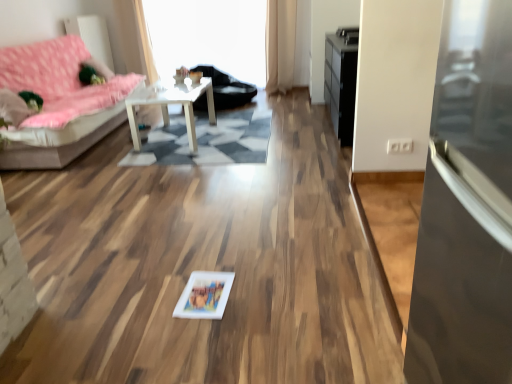
The height and width of the screenshot is (384, 512). In order to click on free location in front of white glossy picture frame at center in this screenshot , I will do `click(199, 333)`.